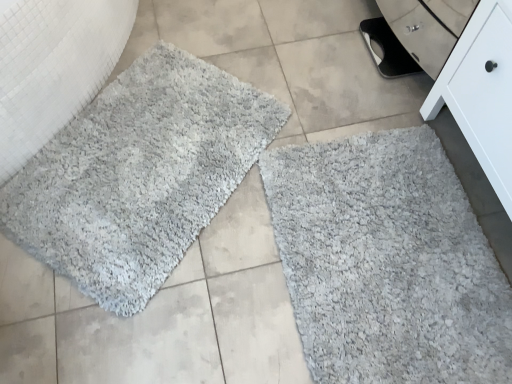
Question: Is gray shaggy bath mat at lower right, which appears as the first bath mat when viewed from the right, outside white matte cabinet at lower right?

Choices:
 (A) no
 (B) yes

Answer: (B)

Question: Is gray shaggy bath mat at lower right, marked as the second bath mat in a left-to-right arrangement, positioned far away from white matte cabinet at lower right?

Choices:
 (A) yes
 (B) no

Answer: (B)

Question: Does gray shaggy bath mat at lower right, which appears as the first bath mat when viewed from the right, lie in front of white matte cabinet at lower right?

Choices:
 (A) yes
 (B) no

Answer: (B)

Question: Does gray shaggy bath mat at lower right, which appears as the first bath mat when viewed from the right, contain white matte cabinet at lower right?

Choices:
 (A) yes
 (B) no

Answer: (B)

Question: Can you confirm if gray shaggy bath mat at lower right, marked as the second bath mat in a left-to-right arrangement, is positioned to the left of white matte cabinet at lower right?

Choices:
 (A) no
 (B) yes

Answer: (B)

Question: Considering the relative sizes of gray shaggy bath mat at lower right, which appears as the first bath mat when viewed from the right, and white matte cabinet at lower right in the image provided, is gray shaggy bath mat at lower right, which appears as the first bath mat when viewed from the right, bigger than white matte cabinet at lower right?

Choices:
 (A) yes
 (B) no

Answer: (B)

Question: Is the depth of gray shaggy rug at left greater than that of gray shaggy bath mat at lower right, marked as the second bath mat in a left-to-right arrangement?

Choices:
 (A) yes
 (B) no

Answer: (B)

Question: Is gray shaggy bath mat at lower right, marked as the second bath mat in a left-to-right arrangement, located within gray shaggy rug at left?

Choices:
 (A) no
 (B) yes

Answer: (A)

Question: Considering the relative positions of gray shaggy rug at left and gray shaggy bath mat at lower right, which appears as the first bath mat when viewed from the right, in the image provided, is gray shaggy rug at left to the right of gray shaggy bath mat at lower right, which appears as the first bath mat when viewed from the right, from the viewer's perspective?

Choices:
 (A) yes
 (B) no

Answer: (B)

Question: Considering the relative sizes of gray shaggy rug at left and gray shaggy bath mat at lower right, marked as the second bath mat in a left-to-right arrangement, in the image provided, is gray shaggy rug at left taller than gray shaggy bath mat at lower right, marked as the second bath mat in a left-to-right arrangement,?

Choices:
 (A) yes
 (B) no

Answer: (A)

Question: Is gray shaggy rug at left wider than gray shaggy bath mat at lower right, which appears as the first bath mat when viewed from the right?

Choices:
 (A) no
 (B) yes

Answer: (A)

Question: Is gray shaggy rug at left closer to the viewer compared to gray shaggy bath mat at lower right, which appears as the first bath mat when viewed from the right?

Choices:
 (A) yes
 (B) no

Answer: (A)

Question: From the image's perspective, is white matte cabinet at lower right located beneath gray shaggy rug at upper left, which is the second bath mat in right-to-left order?

Choices:
 (A) yes
 (B) no

Answer: (B)